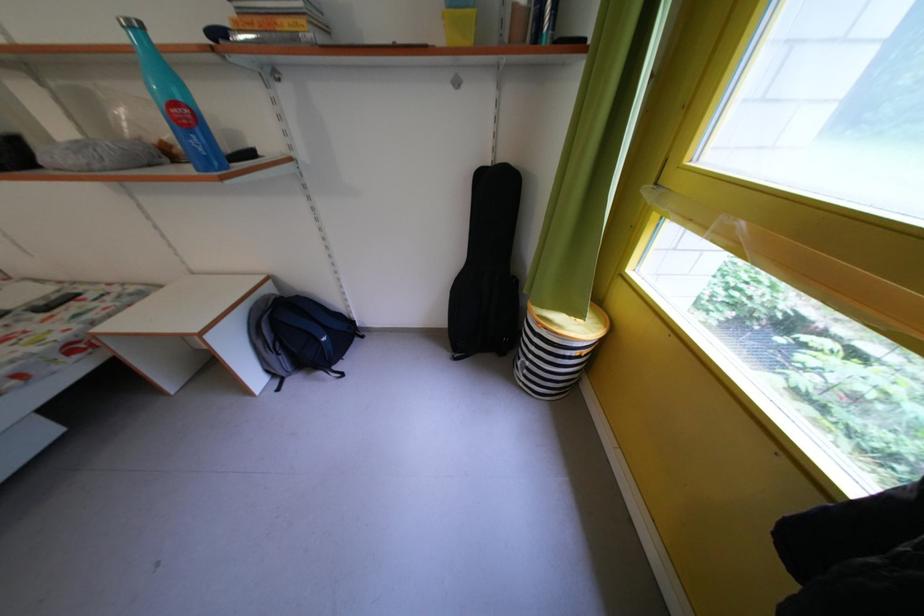
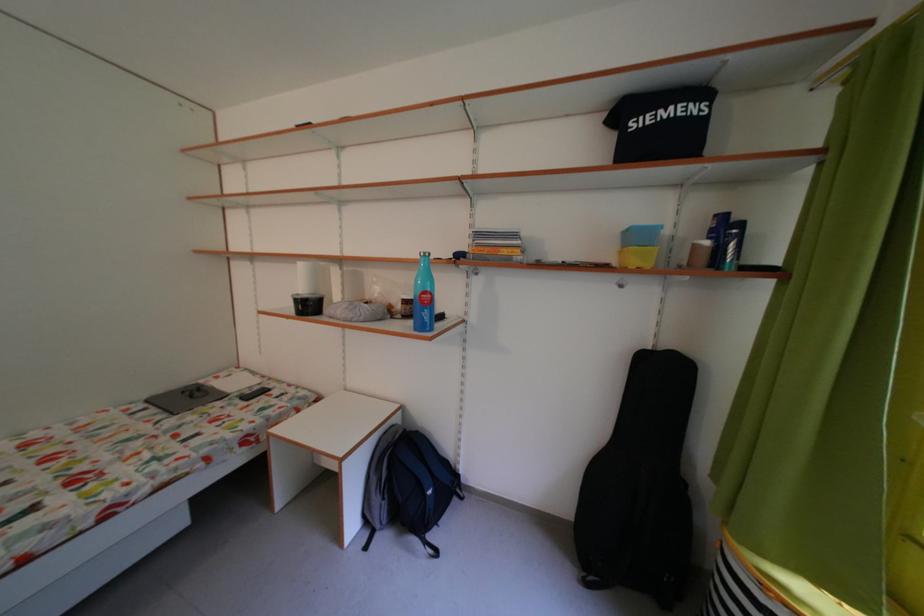
Find the pixel in the second image that matches pixel 553 34 in the first image.

(736, 265)